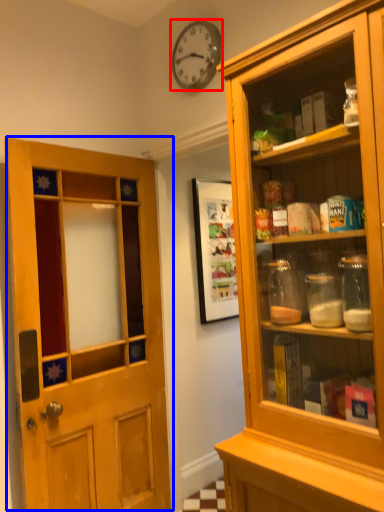
Question: Which object appears farthest to the camera in this image, clock (highlighted by a red box) or door (highlighted by a blue box)?

Choices:
 (A) clock
 (B) door

Answer: (A)